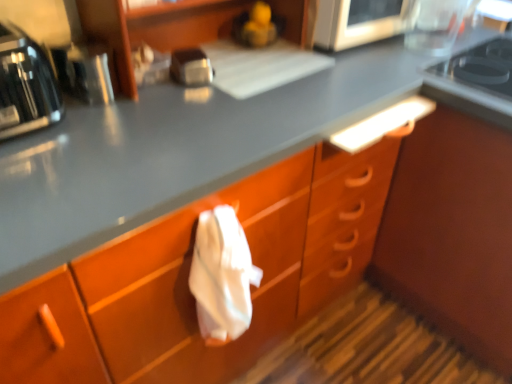
Question: From a real-world perspective, is black glass gas stove at upper right positioned above or below wooden shelf at upper center?

Choices:
 (A) below
 (B) above

Answer: (A)

Question: Looking at their shapes, would you say black glass gas stove at upper right is wider or thinner than wooden shelf at upper center?

Choices:
 (A) thin
 (B) wide

Answer: (B)

Question: Estimate the real-world distances between objects in this image. Which object is farther from the metallic silver microwave at upper center, acting as the first appliance starting from the right?

Choices:
 (A) satin silver toaster at upper center
 (B) metallic silver toaster at left, which is the first appliance from left to right
 (C) black glass gas stove at upper right
 (D) wooden shelf at upper center
 (E) shiny black toaster at left

Answer: (E)

Question: Which of these objects is positioned farthest from the shiny black toaster at left?

Choices:
 (A) metallic silver microwave at upper center, the second appliance positioned from the front
 (B) metallic silver toaster at left, which is counted as the second appliance, starting from the back
 (C) wooden shelf at upper center
 (D) black glass gas stove at upper right
 (E) satin silver toaster at upper center

Answer: (D)